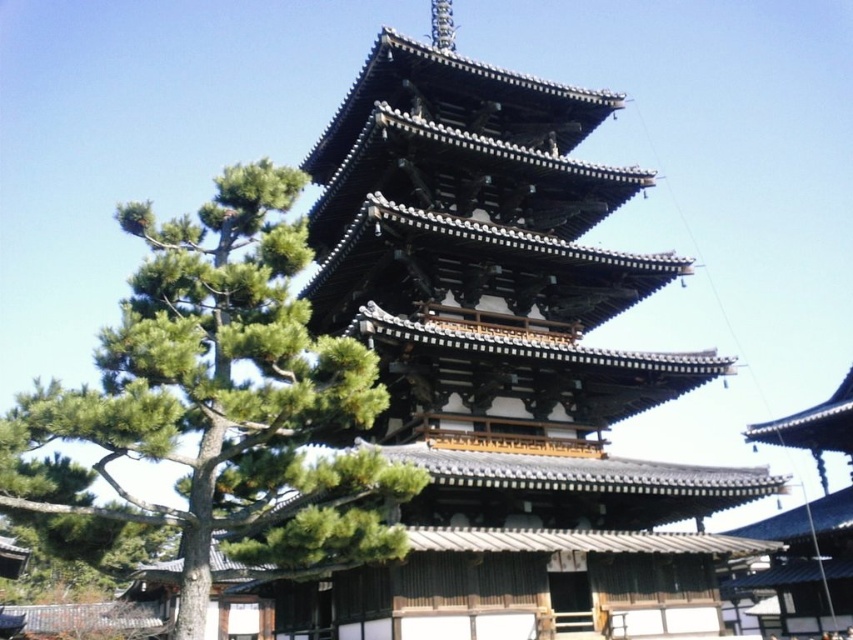
Question: Which point is farther from the camera taking this photo?

Choices:
 (A) (370, 145)
 (B) (299, 552)

Answer: (A)

Question: Which object is closer to the camera taking this photo?

Choices:
 (A) shiny dark brown wooden pagoda at center
 (B) green leafy tree at left

Answer: (B)

Question: Where is shiny dark brown wooden pagoda at center located in relation to green leafy tree at left in the image?

Choices:
 (A) above
 (B) below

Answer: (B)

Question: Is shiny dark brown wooden pagoda at center above green leafy tree at left?

Choices:
 (A) no
 (B) yes

Answer: (A)

Question: Is shiny dark brown wooden pagoda at center thinner than green leafy tree at left?

Choices:
 (A) no
 (B) yes

Answer: (A)